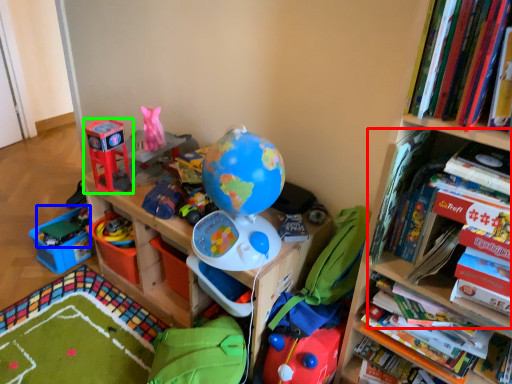
Question: Considering the real-world distances, which object is closest to book (highlighted by a red box)? toy (highlighted by a blue box) or toy (highlighted by a green box).

Choices:
 (A) toy
 (B) toy

Answer: (B)